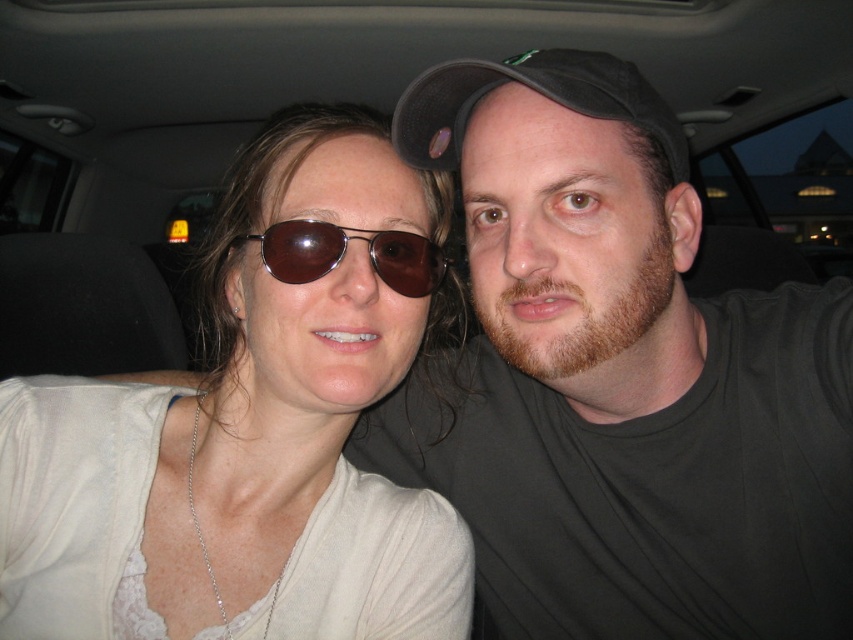
Measure the distance from black fabric baseball cap at upper center to brown reflective sunglasses at center.

5.06 inches

The height and width of the screenshot is (640, 853). I want to click on black fabric baseball cap at upper center, so click(x=537, y=92).

Which is in front, point (376, 182) or point (326, 250)?

Positioned in front is point (326, 250).

Is matte white shirt at left further to the viewer compared to brown reflective sunglasses at center?

That is False.

What do you see at coordinates (250, 429) in the screenshot? I see `matte white shirt at left` at bounding box center [250, 429].

Identify the location of matte white shirt at left. (250, 429).

Which of these two, matte white shirt at left or black fabric baseball cap at upper center, stands shorter?

black fabric baseball cap at upper center

Image resolution: width=853 pixels, height=640 pixels. In order to click on matte white shirt at left in this screenshot , I will do `click(250, 429)`.

Is point (439, 500) positioned after point (419, 150)?

Yes, point (439, 500) is farther from viewer.

Image resolution: width=853 pixels, height=640 pixels. Identify the location of matte white shirt at left. (250, 429).